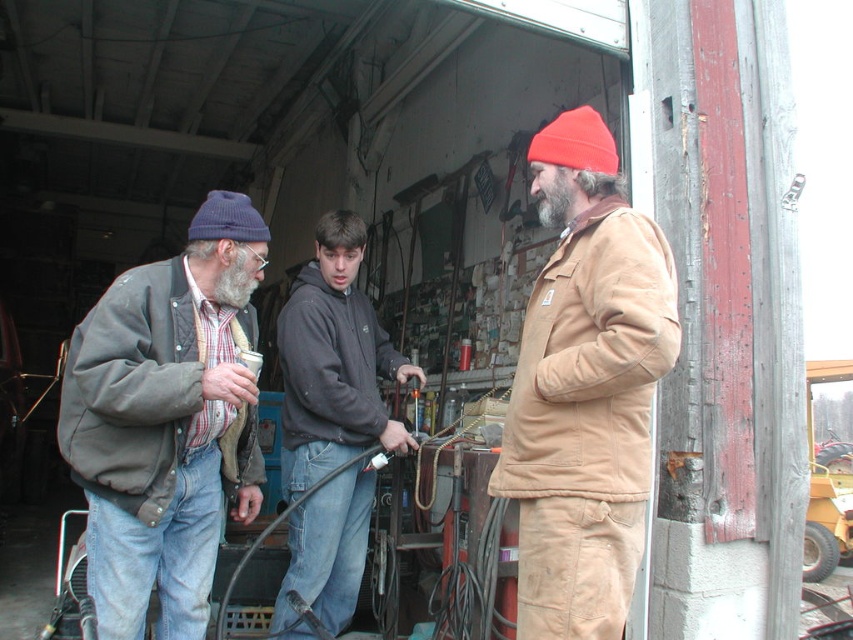
Is matte gray jacket at left thinner than gray/bearded man at center?

No, matte gray jacket at left is not thinner than gray/bearded man at center.

Who is lower down, matte gray jacket at left or gray/bearded man at center?

matte gray jacket at left

Between point (67, 461) and point (537, 179), which one is positioned in front?

Positioned in front is point (537, 179).

The image size is (853, 640). In order to click on matte gray jacket at left in this screenshot , I will do click(163, 432).

Looking at this image, is dark gray hoodie at center shorter than orange knit beanie at center?

No, dark gray hoodie at center is not shorter than orange knit beanie at center.

Who is higher up, dark gray hoodie at center or orange knit beanie at center?

orange knit beanie at center

The image size is (853, 640). What do you see at coordinates (334, 362) in the screenshot?
I see `dark gray hoodie at center` at bounding box center [334, 362].

Find the location of a particular element. dark gray hoodie at center is located at coordinates (334, 362).

Can you confirm if tan suede jacket at right is shorter than dark gray fleece jacket at center?

Incorrect, tan suede jacket at right's height does not fall short of dark gray fleece jacket at center's.

Is point (512, 461) positioned behind point (364, 403)?

That is False.

Is point (538, 448) farther from viewer compared to point (341, 440)?

That is False.

The image size is (853, 640). In order to click on tan suede jacket at right in this screenshot , I will do `click(590, 362)`.